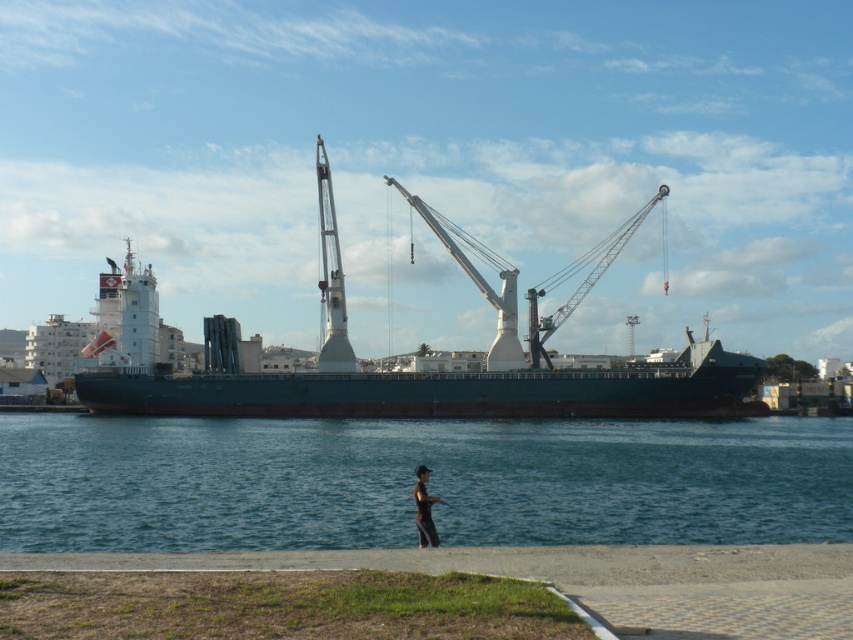
You are standing at the edge of the walkway and want to take a photo of the green matte ship at center without the black fabric person at lower center blocking the view. Which direction should you move to ensure the person is out of frame?

Move to the left side of the walkway so that the green matte ship at center is no longer blocked by the black fabric person at lower center, since the ship is to the right of the person.

Looking at this image, you are standing on the walkway and want to take a photo of the green matte ship at center and the clear blue water at center. Which one should you zoom in on more to capture both in the frame?

The clear blue water at center is smaller than the green matte ship at center, so you should zoom in more on the green matte ship at center to ensure both fit in the frame.